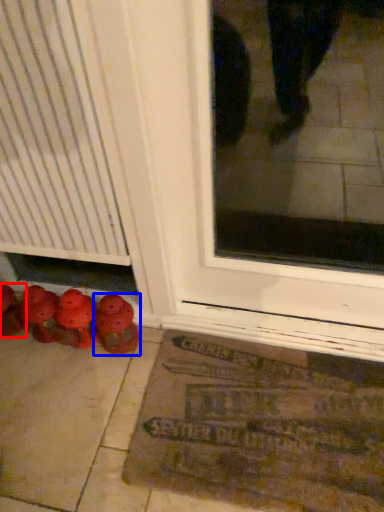
Question: Which object appears farthest to the camera in this image, footwear (highlighted by a red box) or footwear (highlighted by a blue box)?

Choices:
 (A) footwear
 (B) footwear

Answer: (A)